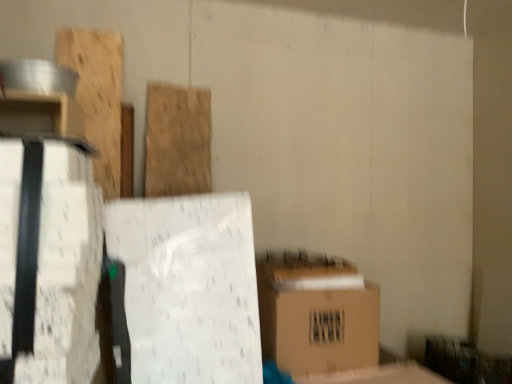
Question: Is point (75, 375) positioned closer to the camera than point (66, 51)?

Choices:
 (A) farther
 (B) closer

Answer: (B)

Question: Would you say white matte cardboard box at left is to the left or to the right of wooden plank at upper left, the first wood from the left, in the picture?

Choices:
 (A) left
 (B) right

Answer: (B)

Question: Estimate the real-world distances between objects in this image. Which object is closer to the brown cardboard box at lower right?

Choices:
 (A) white matte cardboard box at left
 (B) wooden plank at upper left, the first wood from the left
 (C) natural wood plank at center, the 1th wood viewed from the right

Answer: (C)

Question: Estimate the real-world distances between objects in this image. Which object is farther from the natural wood plank at center, marked as the second wood in a left-to-right arrangement?

Choices:
 (A) wooden plank at upper left, marked as the second wood in a right-to-left arrangement
 (B) brown cardboard box at lower right
 (C) white matte cardboard box at left

Answer: (C)